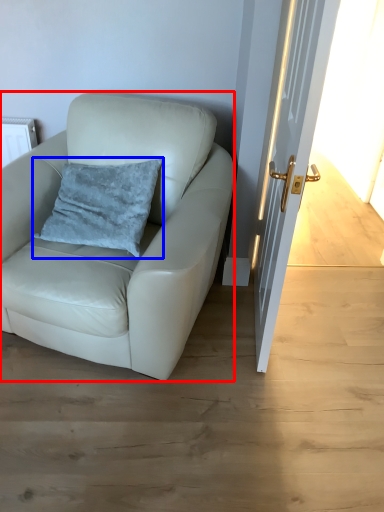
Question: Which of the following is the farthest to the observer, chair (highlighted by a red box) or pillow (highlighted by a blue box)?

Choices:
 (A) chair
 (B) pillow

Answer: (B)